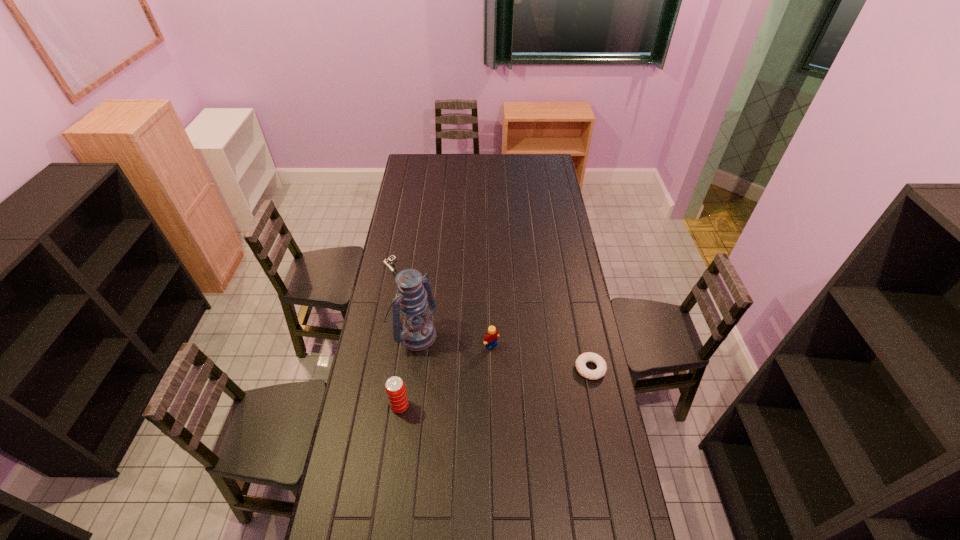
The image size is (960, 540). I want to click on soda can situated at the left edge, so click(395, 389).

I want to click on lantern that is at the left edge, so click(x=415, y=331).

This screenshot has width=960, height=540. I want to click on pistol located at the left edge, so point(388,262).

Find the location of a particular element. The width and height of the screenshot is (960, 540). object present at the right edge is located at coordinates (581, 361).

You are a GUI agent. You are given a task and a screenshot of the screen. Output one action in this format:
    pyautogui.click(x=<x>, y=<y>)
    Task: Click on the vacant area at the far edge
    The height and width of the screenshot is (540, 960).
    Given the screenshot: What is the action you would take?
    pyautogui.click(x=431, y=174)

Identify the location of vacant area at the near edge of the desktop. The width and height of the screenshot is (960, 540). (382, 526).

In the image, there is a desktop. Identify the location of vacant space at the left edge. (394, 376).

In the image, there is a desktop. Identify the location of vacant space at the right edge. This screenshot has width=960, height=540. (567, 228).

This screenshot has width=960, height=540. What are the coordinates of `empty space between the pistol and the second nearest object` in the screenshot? It's located at (492, 319).

In order to click on unoccupied position between the Lego and the soda can in this screenshot , I will do `click(445, 376)`.